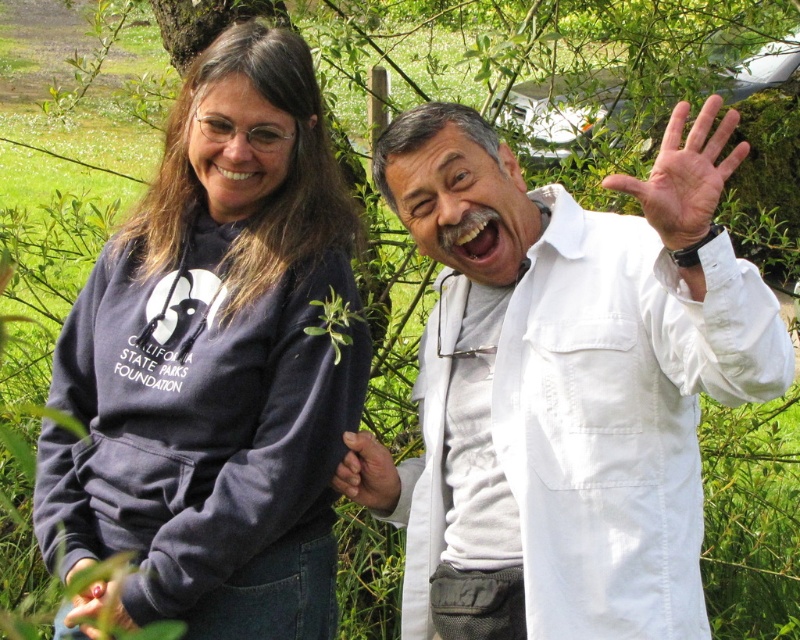
Consider the image. Does white cotton lab coat at right lie in front of black matte hand at lower left?

Yes, it is in front of black matte hand at lower left.

Who is positioned more to the right, white cotton lab coat at right or black matte hand at lower left?

white cotton lab coat at right

Is point (504, 467) behind point (116, 582)?

No, (504, 467) is in front of (116, 582).

Identify the location of white cotton lab coat at right. The width and height of the screenshot is (800, 640). (572, 378).

Is white cotton lab coat at right below smooth skin hand at center?

No, white cotton lab coat at right is not below smooth skin hand at center.

Is white cotton lab coat at right further to camera compared to smooth skin hand at center?

No, white cotton lab coat at right is closer to the viewer.

Who is more distant from viewer, [437,138] or [356,483]?

The point [356,483] is more distant.

I want to click on white cotton lab coat at right, so click(x=572, y=378).

In order to click on white cotton lab coat at right in this screenshot , I will do `click(572, 378)`.